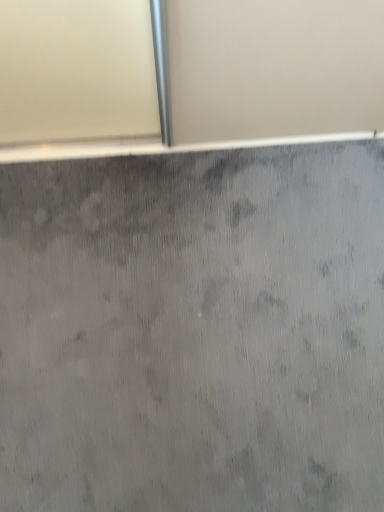
The width and height of the screenshot is (384, 512). What do you see at coordinates (194, 331) in the screenshot?
I see `gray matte concrete at center` at bounding box center [194, 331].

At what (x,y) coordinates should I click in order to perform the action: click on gray matte concrete at center. Please return your answer as a coordinate pair (x, y). Image resolution: width=384 pixels, height=512 pixels. Looking at the image, I should click on (194, 331).

Measure the distance between point (x=245, y=443) and camera.

They are 37.80 inches apart.

Locate an element on the screen. gray matte concrete at center is located at coordinates pos(194,331).